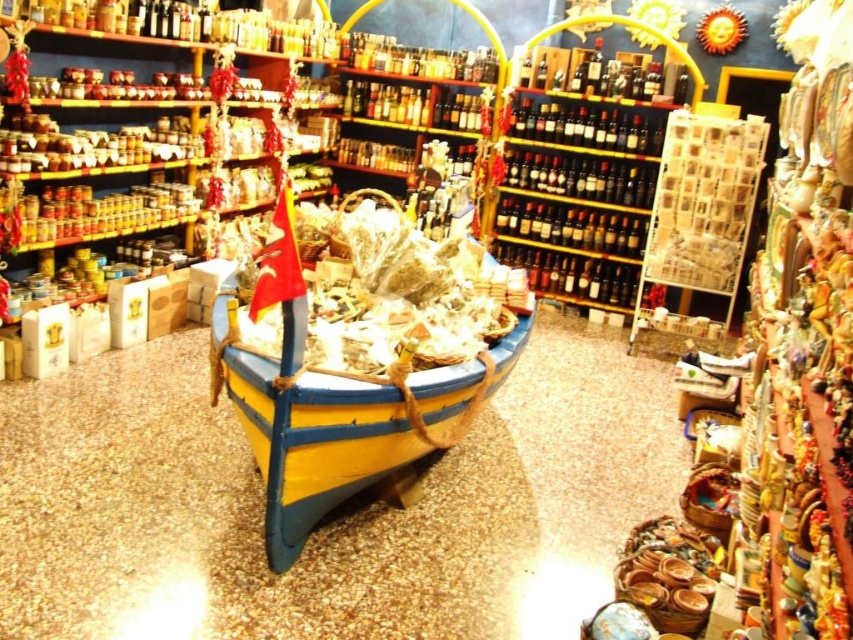
You are a customer in the shop and want to place a small gift box between the yellow wood boat at center and the yellow painted wood boat at center. Based on their positions, which boat should the gift box be placed to the left of?

The yellow wood boat at center is positioned on the right side of yellow painted wood boat at center, so the gift box should be placed to the left of the yellow painted wood boat at center.

You are a customer in the shop holding the matte plastic bag at center. You want to pick up the yellow wood boat at center to examine it. Is the boat within your reach without moving the bag?

The distance between the yellow wood boat at center and the matte plastic bag at center is 1.09 meters. Since the average arm length is about 0.7 meters, you would need to move the bag or take a step forward to reach the boat.

You are a customer in the shop and want to take a photo of the yellow wood boat at center and the yellow painted wood boat at center. Which one is closer to you?

The yellow wood boat at center is closer to you because it is in front of the yellow painted wood boat at center.